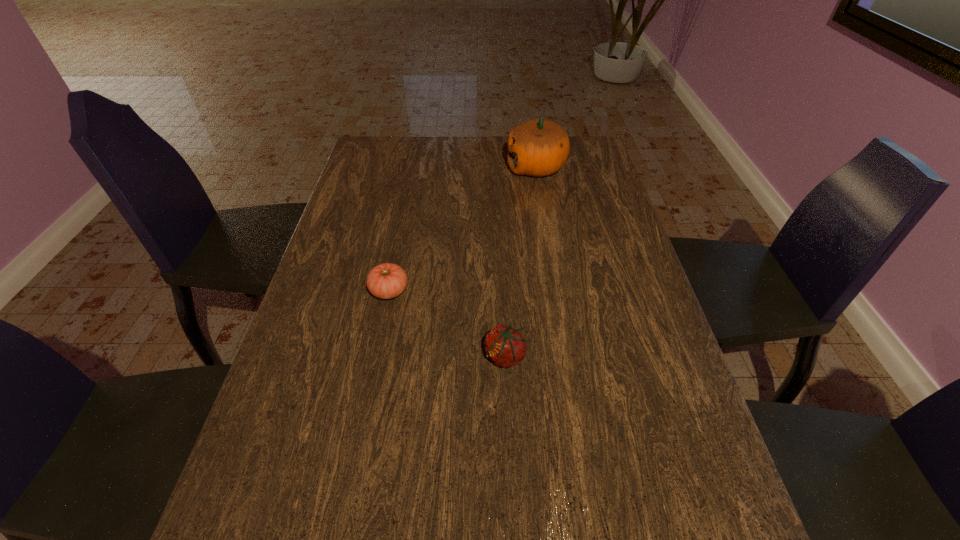
At what (x,y) coordinates should I click in order to perform the action: click on free spot located on the back of the leftmost object. Please return your answer as a coordinate pair (x, y). This screenshot has height=540, width=960. Looking at the image, I should click on (401, 228).

The height and width of the screenshot is (540, 960). I want to click on object positioned at the far edge, so click(x=538, y=147).

Where is `object positioned at the left edge`? This screenshot has width=960, height=540. object positioned at the left edge is located at coordinates point(385,281).

Image resolution: width=960 pixels, height=540 pixels. In order to click on object that is at the right edge in this screenshot , I will do `click(538, 147)`.

Identify the location of object at the far right corner. (538, 147).

In order to click on free region at the far edge in this screenshot , I will do `click(438, 156)`.

In the image, there is a desktop. Identify the location of free space at the left edge. (339, 279).

Locate an element on the screen. The image size is (960, 540). free space at the right edge of the desktop is located at coordinates (565, 203).

This screenshot has width=960, height=540. In order to click on vacant space at the far left corner in this screenshot , I will do `click(377, 144)`.

Where is `unoccupied area between the pumpkin and the second nearest object`? unoccupied area between the pumpkin and the second nearest object is located at coordinates (463, 229).